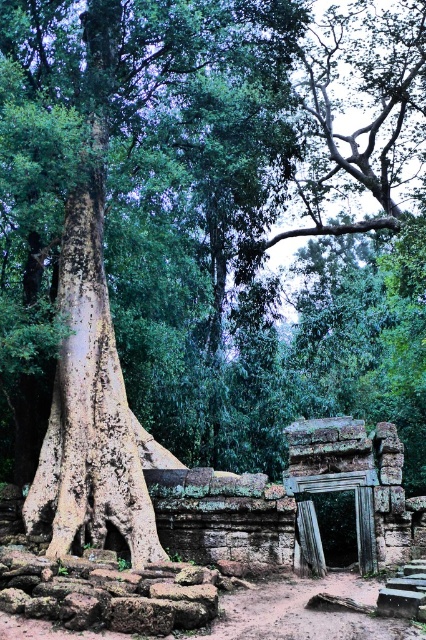
Question: Can you confirm if speckled bark tree trunk at left is wider than brown rough tree root at lower center?

Choices:
 (A) no
 (B) yes

Answer: (B)

Question: Which object is closer to the camera taking this photo?

Choices:
 (A) speckled bark tree trunk at left
 (B) brown rough tree root at lower center

Answer: (B)

Question: Which point is closer to the camera?

Choices:
 (A) speckled bark tree trunk at left
 (B) brown rough tree root at lower center

Answer: (B)

Question: Does speckled bark tree trunk at left come in front of brown rough tree root at lower center?

Choices:
 (A) no
 (B) yes

Answer: (A)

Question: From the image, what is the correct spatial relationship of speckled bark tree trunk at left in relation to brown rough tree root at lower center?

Choices:
 (A) left
 (B) right

Answer: (A)